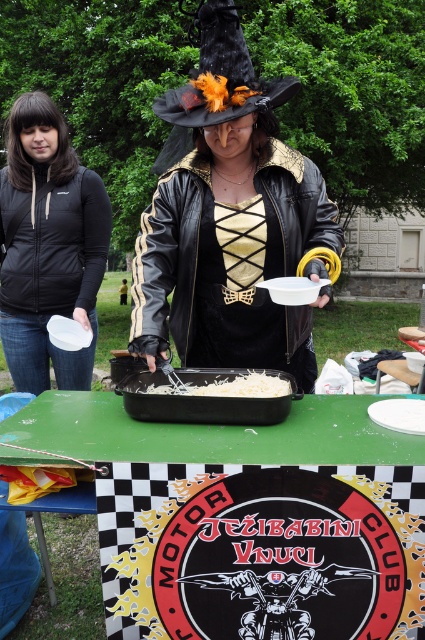
Question: Which point appears farthest from the camera in this image?

Choices:
 (A) (22, 312)
 (B) (243, 310)

Answer: (A)

Question: Among these points, which one is farthest from the camera?

Choices:
 (A) (218, 433)
 (B) (87, 198)
 (C) (297, 193)
 (D) (175, 122)

Answer: (B)

Question: In this image, where is black matte jacket at upper left located relative to black felt witch hat at upper center?

Choices:
 (A) left
 (B) right

Answer: (A)

Question: Does green plastic table at center appear under black matte jacket at upper left?

Choices:
 (A) yes
 (B) no

Answer: (A)

Question: Does black matte jacket at upper left have a greater width compared to black felt witch hat at upper center?

Choices:
 (A) yes
 (B) no

Answer: (A)

Question: Among these points, which one is farthest from the camera?

Choices:
 (A) (235, 8)
 (B) (133, 340)

Answer: (B)